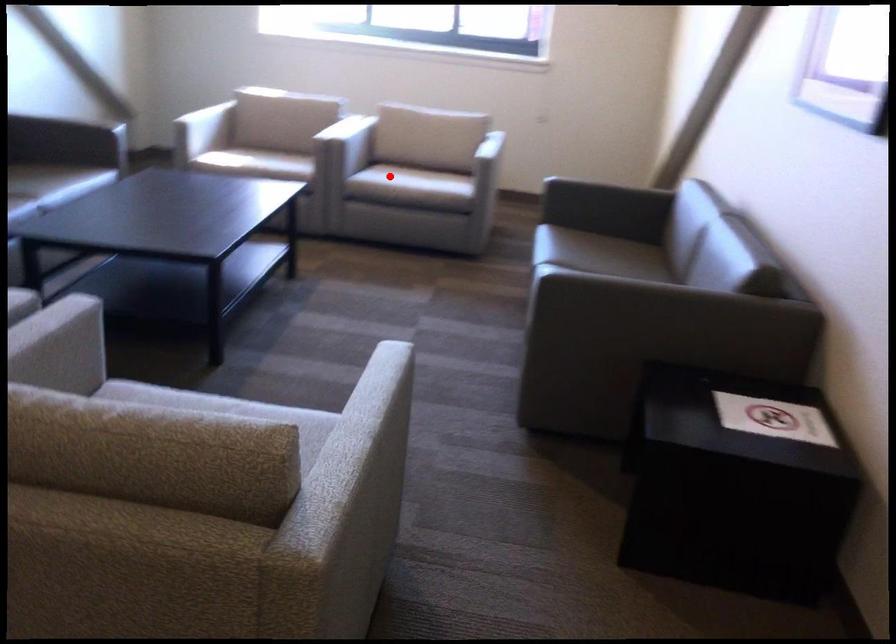
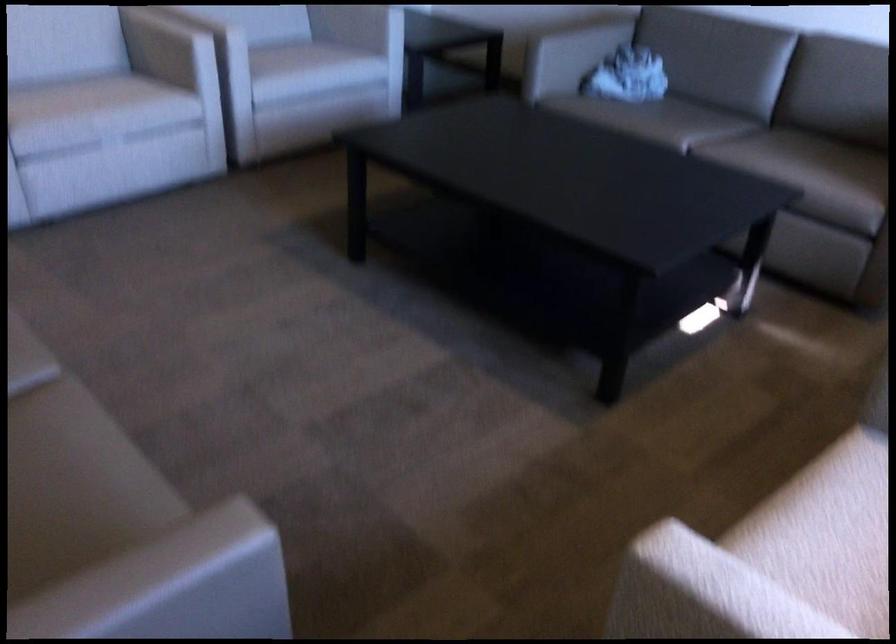
Where in the second image is the point corresponding to the highlighted location from the first image?

(830, 509)